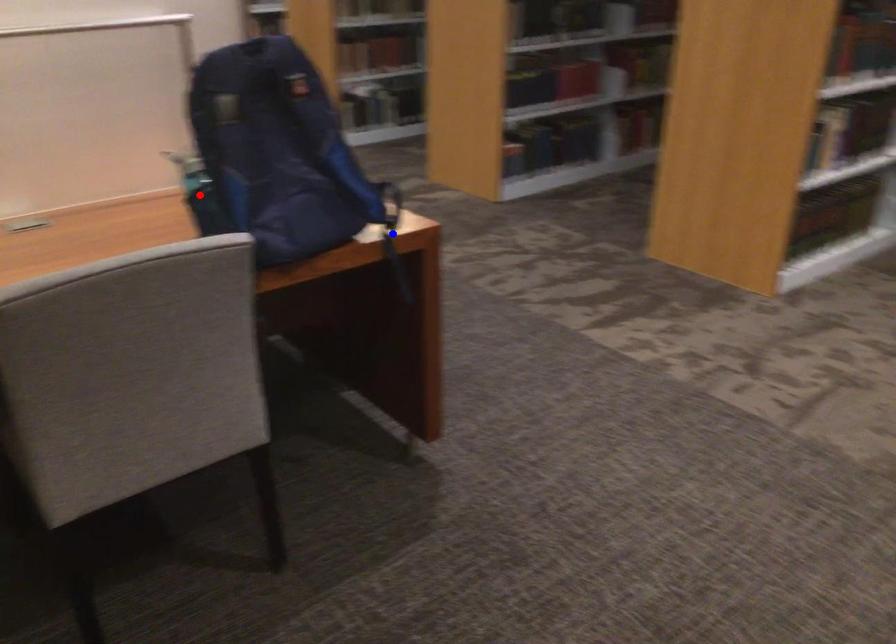
Question: In the image, two points are highlighted. Which point is nearer to the camera? Reply with the corresponding letter.

Choices:
 (A) blue point
 (B) red point

Answer: (B)